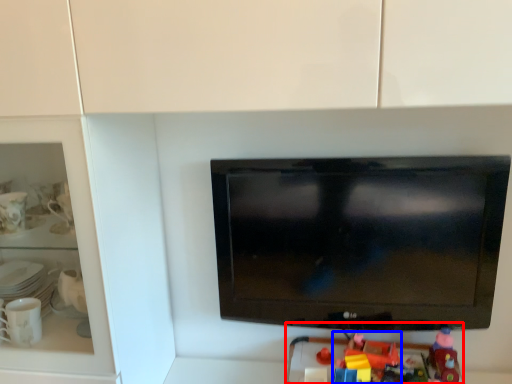
Question: Which of the following is the closest to the observer, toy (highlighted by a red box) or toy (highlighted by a blue box)?

Choices:
 (A) toy
 (B) toy

Answer: (A)